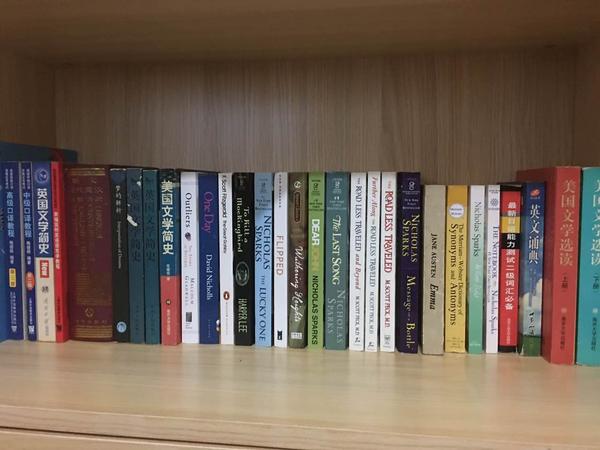
This screenshot has width=600, height=450. What are the coordinates of `books with blue spines` in the screenshot? It's located at (13, 311), (24, 316), (3, 331), (208, 305), (333, 291), (594, 331), (528, 270), (82, 418).